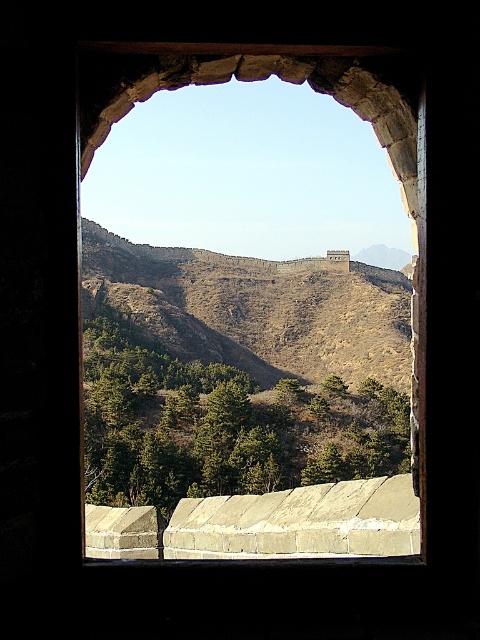
Question: Among these objects, which one is farthest from the camera?

Choices:
 (A) brown/dry grassy hillside at center
 (B) stone archway at center

Answer: (A)

Question: Is brown/dry grassy hillside at center positioned in front of stone archway at center?

Choices:
 (A) yes
 (B) no

Answer: (B)

Question: Does brown/dry grassy hillside at center appear under stone archway at center?

Choices:
 (A) yes
 (B) no

Answer: (A)

Question: Does brown/dry grassy hillside at center have a greater width compared to stone archway at center?

Choices:
 (A) no
 (B) yes

Answer: (B)